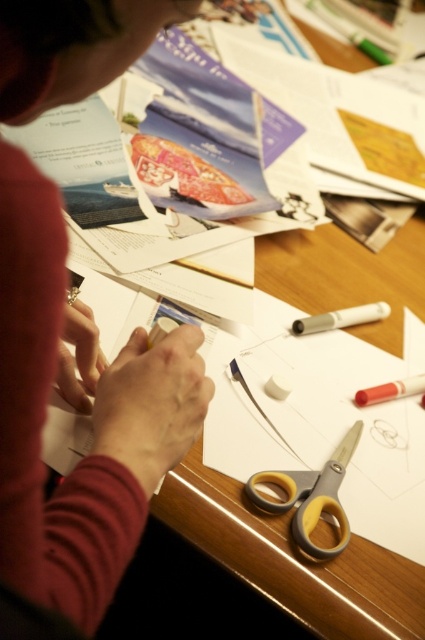
Is matte red sweater at upper left positioned at the back of white matte marker at center?

No, matte red sweater at upper left is closer to the viewer.

Between point (45, 232) and point (379, 301), which one is positioned in front?

Point (45, 232) is in front.

Is point (142, 467) closer to viewer compared to point (339, 323)?

Yes, it is in front of point (339, 323).

Where is `matte red sweater at upper left`? The width and height of the screenshot is (425, 640). matte red sweater at upper left is located at coordinates point(79,410).

Looking at this image, between matte red sweater at upper left and yellow rubberized scissors at center, which one is positioned lower?

Positioned lower is yellow rubberized scissors at center.

Looking at this image, is matte red sweater at upper left to the left of yellow rubberized scissors at center from the viewer's perspective?

Yes, matte red sweater at upper left is to the left of yellow rubberized scissors at center.

Between point (110, 532) and point (311, 497), which one is positioned behind?

The point (311, 497) is behind.

Find the location of a particular element. The image size is (425, 640). matte red sweater at upper left is located at coordinates (79, 410).

Which of these two, yellow rubberized scissors at center or white matte marker at center, stands shorter?

With less height is white matte marker at center.

Is point (317, 560) positioned before point (325, 324)?

That is True.

At what (x,y) coordinates should I click in order to perform the action: click on yellow rubberized scissors at center. Please return your answer as a coordinate pair (x, y). This screenshot has height=640, width=425. Looking at the image, I should click on (309, 497).